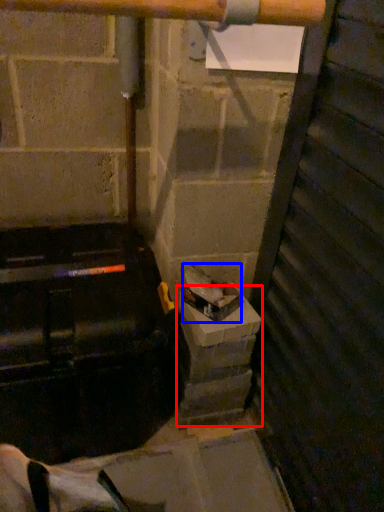
Question: Which object is closer to the camera taking this photo, concrete (highlighted by a red box) or garbage (highlighted by a blue box)?

Choices:
 (A) concrete
 (B) garbage

Answer: (B)